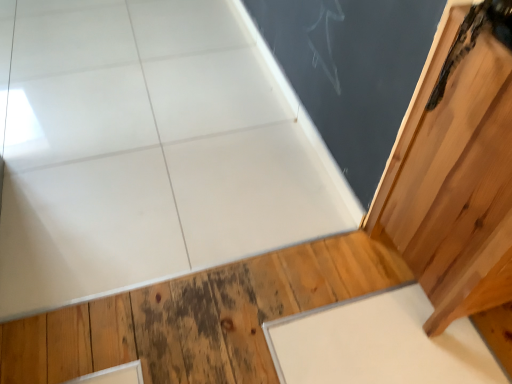
Where is `vacant region above matte black chalkboard at upper right (from a real-world perspective)`? vacant region above matte black chalkboard at upper right (from a real-world perspective) is located at coordinates (279, 65).